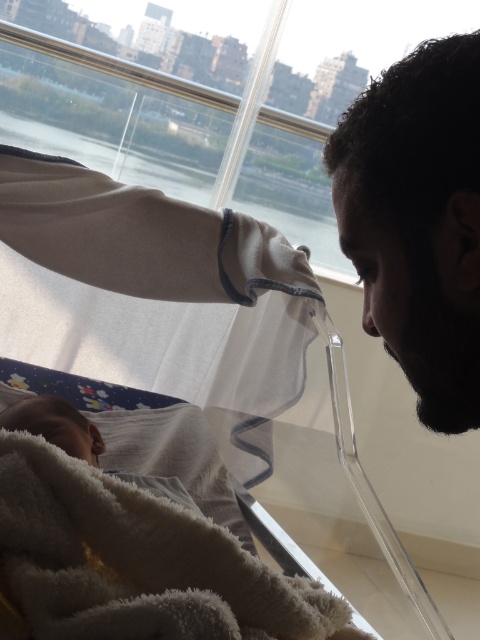
Between dark brown hair at upper right and white fluffy blanket at lower left, which one appears on the left side from the viewer's perspective?

white fluffy blanket at lower left is more to the left.

Is point (422, 58) closer to viewer compared to point (158, 620)?

Yes, it is.

Find the location of a particular element. dark brown hair at upper right is located at coordinates (418, 220).